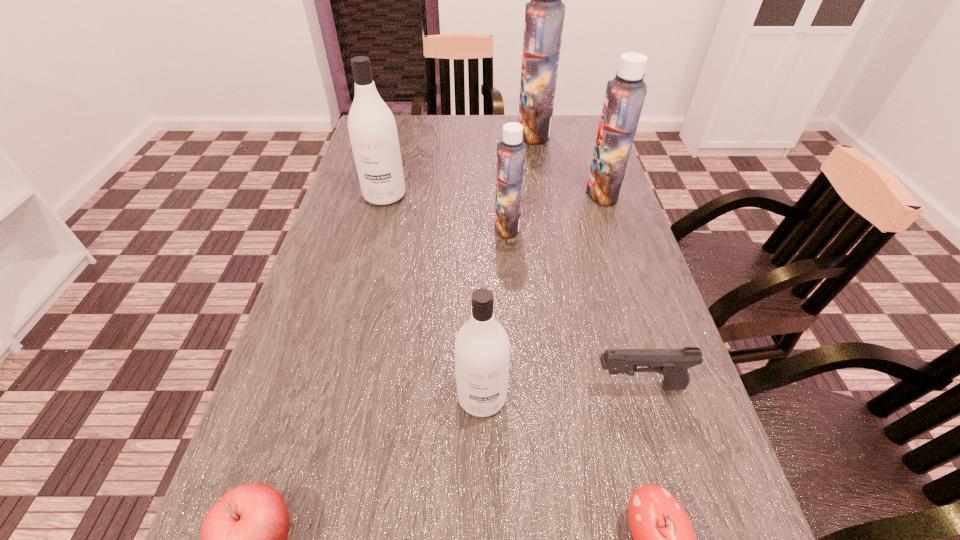
You are a GUI agent. You are given a task and a screenshot of the screen. Output one action in this format:
    pyautogui.click(x=<x>, y=<y>)
    Task: Click on the pistol
    This screenshot has height=540, width=960.
    Given the screenshot: What is the action you would take?
    pyautogui.click(x=673, y=364)

Find the location of a particular element. This screenshot has height=540, width=960. blank space located on the front label of the farthest object is located at coordinates (496, 132).

In order to click on vacant space located on the front label of the farthest object in this screenshot , I will do pyautogui.click(x=463, y=132).

Find the location of a particular element. vacant space located 0.240m on the front label of the farthest object is located at coordinates (444, 132).

Locate an element on the screen. vacant region located on the front label of the rightmost blue shampoo is located at coordinates (543, 192).

Where is `free space located 0.390m on the front label of the rightmost blue shampoo`? This screenshot has width=960, height=540. free space located 0.390m on the front label of the rightmost blue shampoo is located at coordinates (446, 192).

Find the location of `vacant area located on the front label of the rightmost blue shampoo`. vacant area located on the front label of the rightmost blue shampoo is located at coordinates (471, 192).

At what (x,y) coordinates should I click in order to perform the action: click on vacant space located 0.330m on the front-facing side of the bigger white shampoo. Please return your answer as a coordinate pair (x, y). Looking at the image, I should click on (357, 302).

Where is `free space located 0.310m on the front label of the leftmost blue shampoo`? This screenshot has width=960, height=540. free space located 0.310m on the front label of the leftmost blue shampoo is located at coordinates (372, 226).

Locate an element on the screen. vacant space located on the front label of the leftmost blue shampoo is located at coordinates (416, 226).